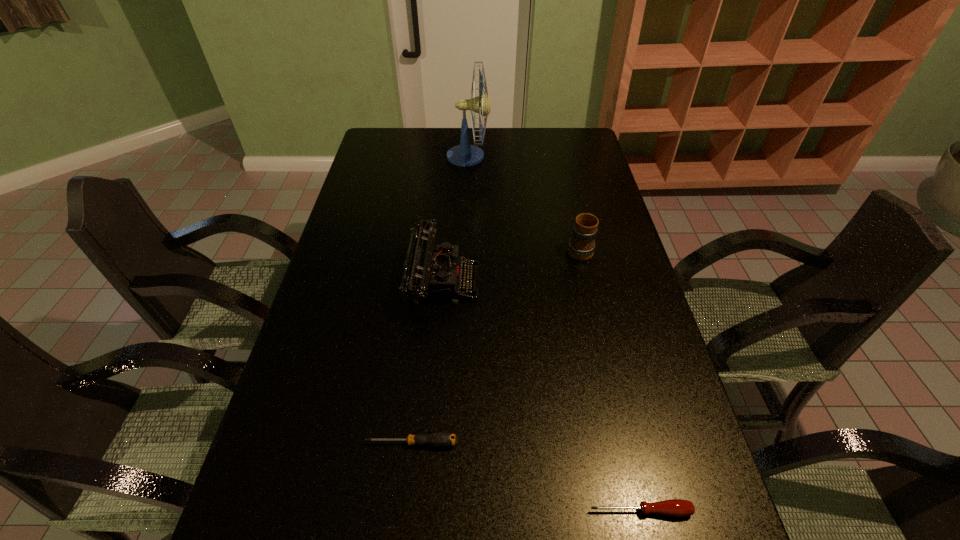
Image resolution: width=960 pixels, height=540 pixels. What are the coordinates of `the farthest object` in the screenshot? It's located at (464, 154).

This screenshot has width=960, height=540. Find the location of `the tallest object`. the tallest object is located at coordinates (464, 154).

This screenshot has height=540, width=960. Identify the location of typewriter. (431, 272).

You are a GUI agent. You are given a task and a screenshot of the screen. Output one action in this format:
    pyautogui.click(x=<x>, y=<y>)
    Task: Click on the mug
    This screenshot has width=960, height=540.
    Given the screenshot: What is the action you would take?
    pyautogui.click(x=581, y=246)

Where is `the left screwdriver`? the left screwdriver is located at coordinates (440, 439).

Image resolution: width=960 pixels, height=540 pixels. I want to click on the second nearest object, so click(x=440, y=439).

Find the location of `the nearer screwdriver`. the nearer screwdriver is located at coordinates pyautogui.click(x=674, y=507).

I want to click on the right screwdriver, so click(674, 507).

The width and height of the screenshot is (960, 540). Identify the location of free location located at the front of the tallest object where the blades are visible. (505, 157).

You are a GUI agent. You are given a task and a screenshot of the screen. Output one action in this format:
    pyautogui.click(x=<x>, y=<y>)
    Task: Click on the vacant point located on the keyboard of the typewriter
    The height and width of the screenshot is (540, 960).
    Given the screenshot: What is the action you would take?
    pos(511,281)